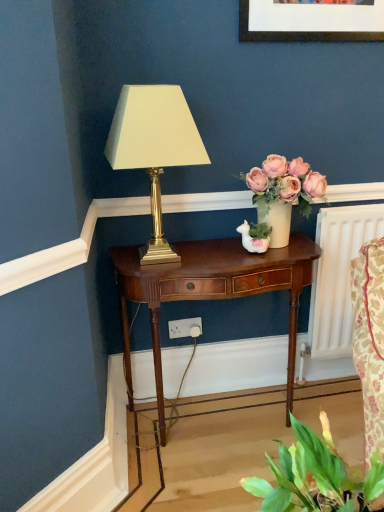
At what (x,y) coordinates should I click in order to perform the action: click on free space that is to the left of matte cream vase with pink roses at center. Please return your answer as a coordinate pair (x, y). Looking at the image, I should click on (221, 249).